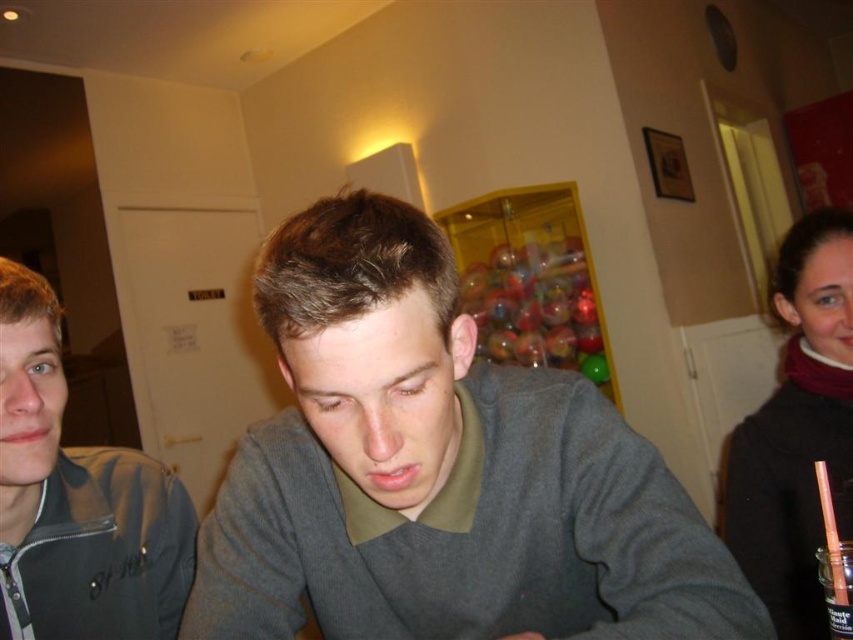
You are taking a photo of two points in the scene. The first point is at coordinates point (109, 458) and the second is at point (741, 468). Which point will appear larger in your photo?

Point (109, 458) is closer to the camera than point (741, 468), so it will appear larger in the photo.

You are organizing a clothing store and need to place the gray matte sweater at center and the velvet maroon scarf at right on a mannequin. Which item should you place first if you want to start with the larger item?

The velvet maroon scarf at right is larger than the gray matte sweater at center, so you should place the velvet maroon scarf at right first.